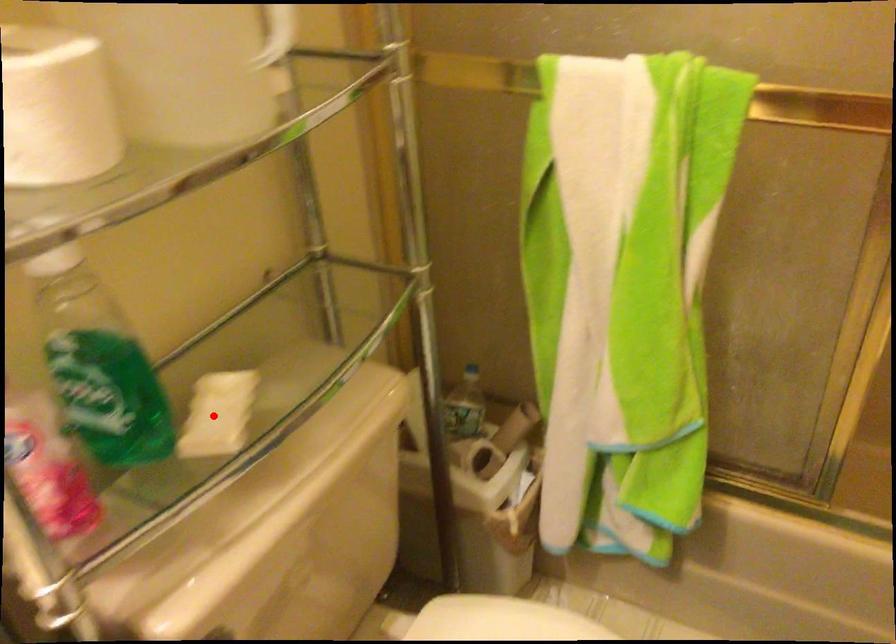
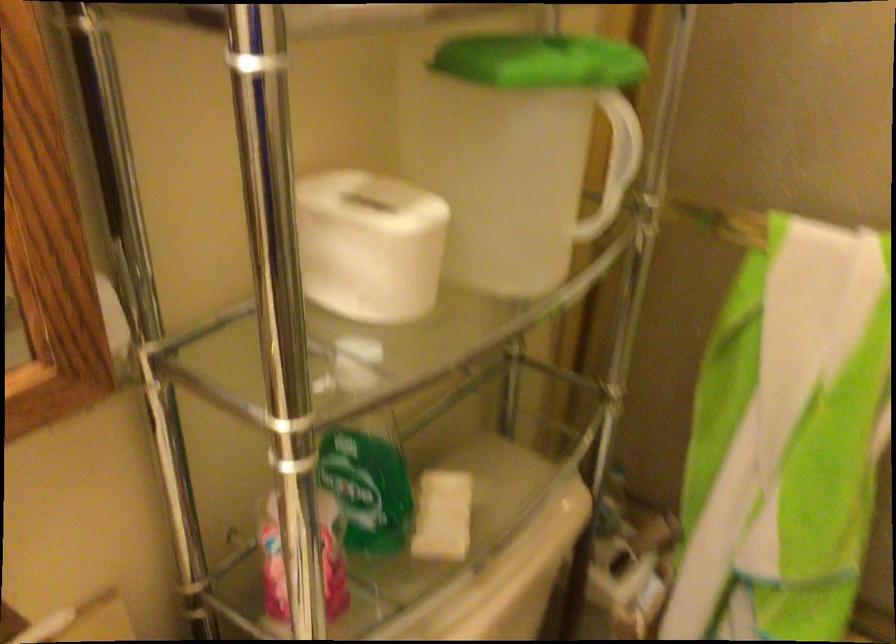
Question: I am providing you with two images of the same scene from different viewpoints. A red point is marked on the first image. At the location where the point appears in image 1, is it still visible in image 2?

Choices:
 (A) Yes
 (B) No

Answer: (A)